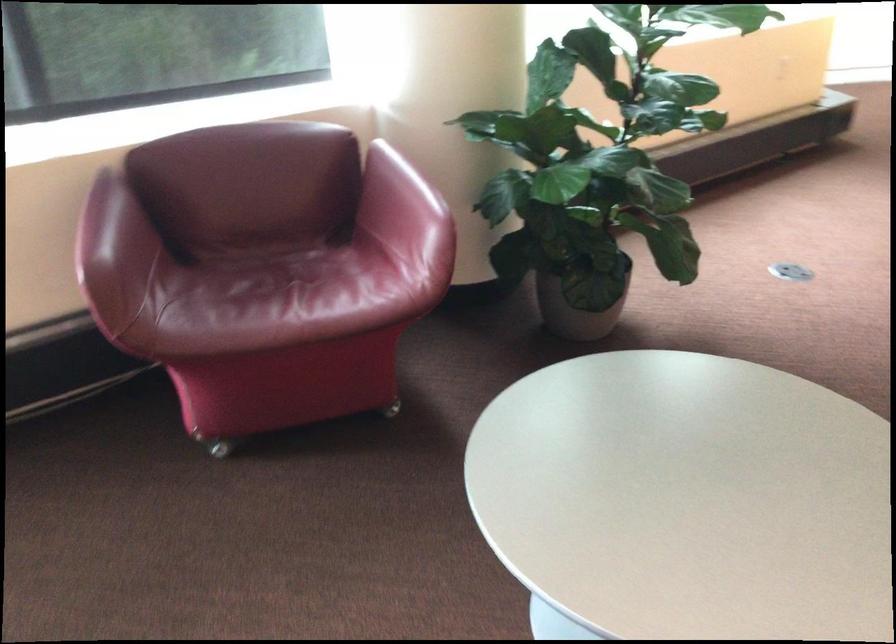
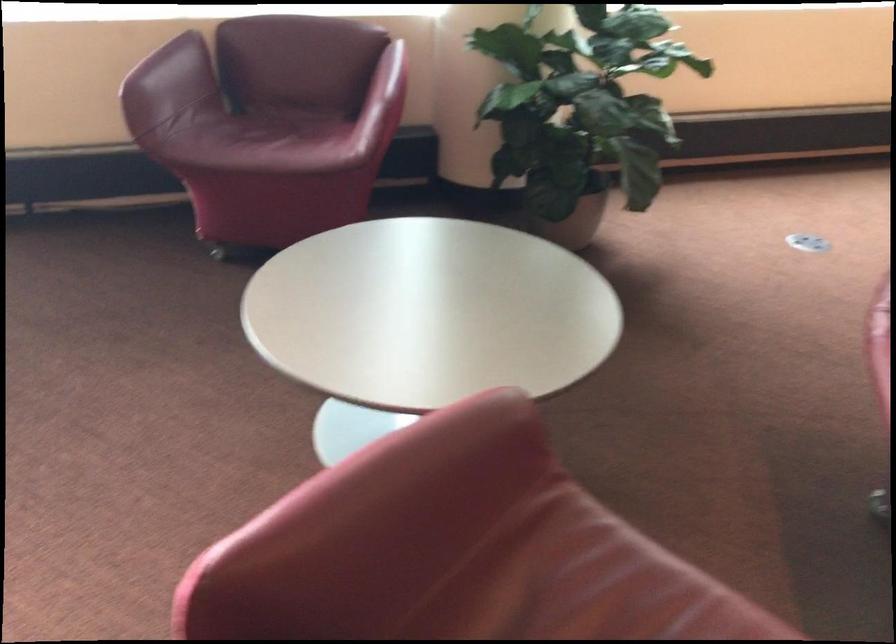
Find the pixel in the second image that matches point (98, 214) in the first image.

(165, 57)